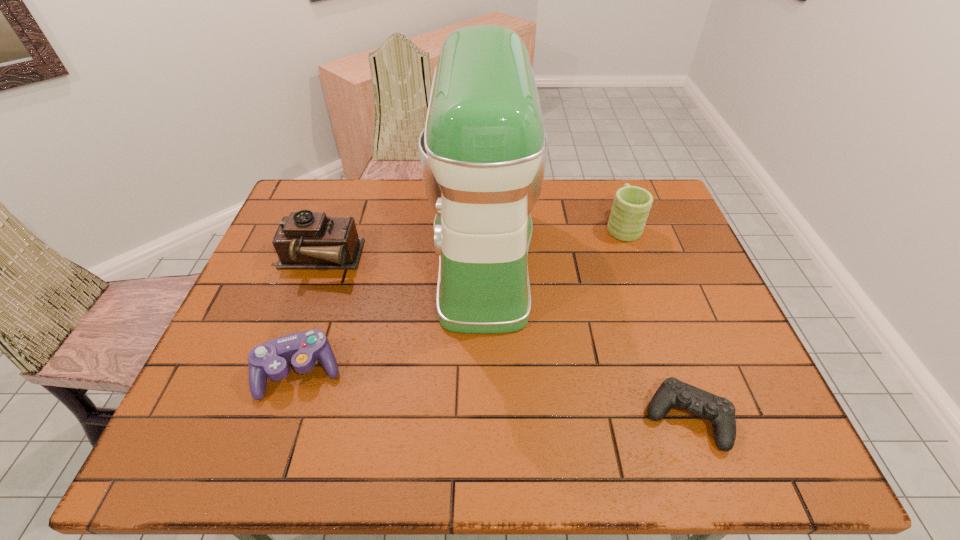
The height and width of the screenshot is (540, 960). What are the coordinates of `control at the left edge` in the screenshot? It's located at (302, 349).

Locate an element on the screen. Image resolution: width=960 pixels, height=540 pixels. mug at the right edge is located at coordinates (631, 206).

Locate an element on the screen. This screenshot has width=960, height=540. control present at the right edge is located at coordinates (672, 392).

The image size is (960, 540). I want to click on object that is at the far right corner, so click(631, 206).

Find the location of a particular element. Image resolution: width=960 pixels, height=540 pixels. object that is at the near right corner is located at coordinates (672, 392).

Find the location of a particular element. Image resolution: width=960 pixels, height=540 pixels. free space at the far edge of the desktop is located at coordinates (589, 184).

Image resolution: width=960 pixels, height=540 pixels. In the image, there is a desktop. Find the location of `vacant space at the near edge`. vacant space at the near edge is located at coordinates (457, 429).

I want to click on vacant region at the right edge of the desktop, so click(x=663, y=294).

Where is `free spot between the third object from left to right and the shorter control`? The height and width of the screenshot is (540, 960). free spot between the third object from left to right and the shorter control is located at coordinates (585, 338).

Locate an element on the screen. Image resolution: width=960 pixels, height=540 pixels. free point between the taller control and the mixer is located at coordinates (392, 315).